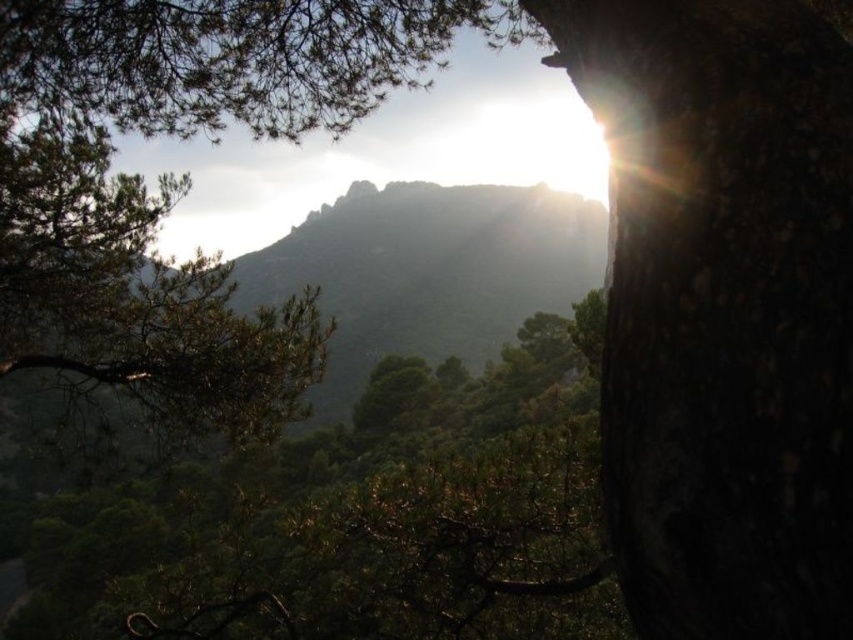
Question: Can you confirm if dark bark tree trunk at right is thinner than green textured tree at upper left?

Choices:
 (A) no
 (B) yes

Answer: (B)

Question: Does green textured leaves at center come in front of green textured tree at upper left?

Choices:
 (A) no
 (B) yes

Answer: (B)

Question: Based on their relative distances, which object is farther from the green textured mountain at upper center?

Choices:
 (A) green textured leaves at center
 (B) green needle-like leaves at left

Answer: (A)

Question: Which of the following is the closest to the observer?

Choices:
 (A) green textured leaves at center
 (B) green textured mountain at upper center
 (C) dark bark tree trunk at right
 (D) green textured tree at upper left

Answer: (C)

Question: Which object is the closest to the green textured mountain at upper center?

Choices:
 (A) green textured tree at upper left
 (B) green needle-like leaves at left
 (C) green textured leaves at center

Answer: (B)

Question: Is dark bark tree trunk at right smaller than green needle-like leaves at left?

Choices:
 (A) yes
 (B) no

Answer: (A)